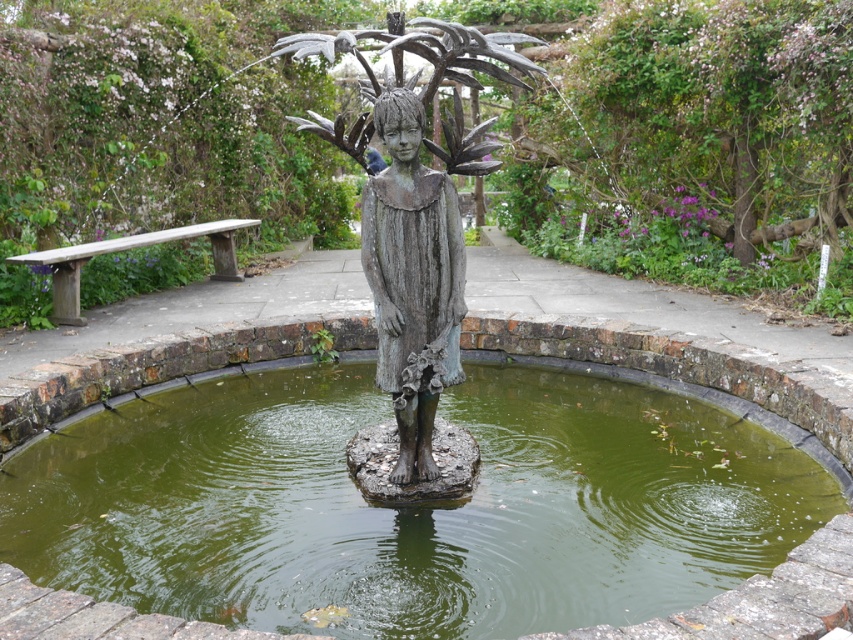
You are a photographer standing at the edge of the pond. You want to take a photo of the rusty bronze statue at center and the green murky water at center. Which object will appear closer to you in the photo?

The rusty bronze statue at center will appear closer to you in the photo because it is positioned further to the viewer than the green murky water at center.

Based on the scene description, can you determine the spatial relationship between the rusty bronze statue at center and the green murky water at center?

The rusty bronze statue at center is to the right of the green murky water at center.